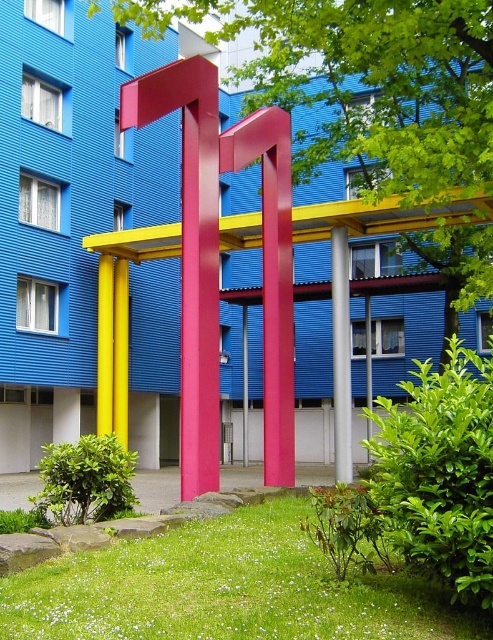
Question: Does metallic pink pole at center have a smaller size compared to matte yellow pillar at center?

Choices:
 (A) no
 (B) yes

Answer: (B)

Question: Which of the following is the farthest from the observer?

Choices:
 (A) matte yellow pillar at center
 (B) white glossy pillar at center

Answer: (A)

Question: Which of these objects is positioned closest to the metallic pink pole at center?

Choices:
 (A) matte yellow pillar at center
 (B) white glossy pillar at center

Answer: (A)

Question: Can you confirm if metallic pink pole at center is thinner than matte yellow pillar at center?

Choices:
 (A) no
 (B) yes

Answer: (B)

Question: Can you confirm if white glossy pillar at center is smaller than matte yellow pillar at center?

Choices:
 (A) yes
 (B) no

Answer: (A)

Question: Which object is the farthest from the metallic pink pole at center?

Choices:
 (A) matte yellow pillar at center
 (B) white glossy pillar at center

Answer: (B)